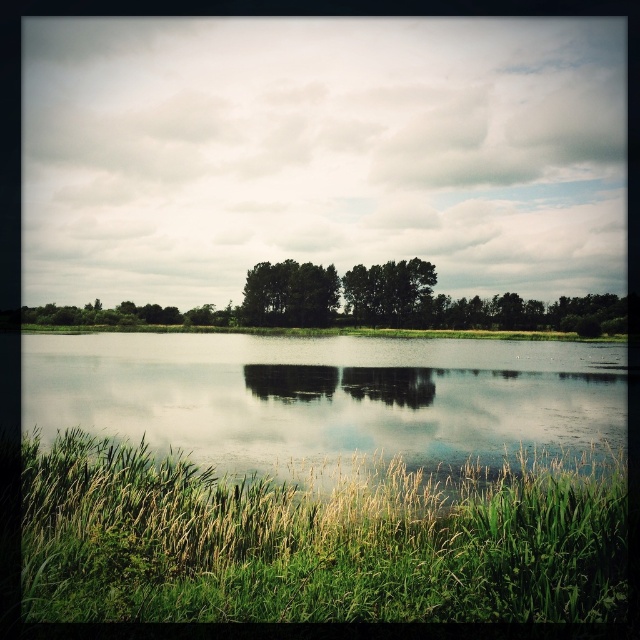
Is transparent water at center smaller than green matte trees at center?

No.

Is point (436, 445) behind point (275, 284)?

No, (436, 445) is in front of (275, 284).

Is point (154, 365) positioned in front of point (296, 307)?

Yes, it is.

This screenshot has width=640, height=640. In order to click on transparent water at center in this screenshot , I will do `click(328, 396)`.

Which is below, green grassy at lower left or green matte trees at center?

Positioned lower is green grassy at lower left.

Does green grassy at lower left lie in front of green matte trees at center?

Yes, it is.

Between point (115, 616) and point (332, 314), which one is positioned in front?

Positioned in front is point (115, 616).

Where is `green grassy at lower left`? The image size is (640, 640). green grassy at lower left is located at coordinates (314, 541).

Between green grassy at lower left and green matte tree at center, which one is positioned higher?

Positioned higher is green matte tree at center.

Is green grassy at lower left smaller than green matte tree at center?

Yes, green grassy at lower left is smaller than green matte tree at center.

Measure the distance between green grassy at lower left and camera.

green grassy at lower left is 6.97 meters from camera.

I want to click on green grassy at lower left, so tap(314, 541).